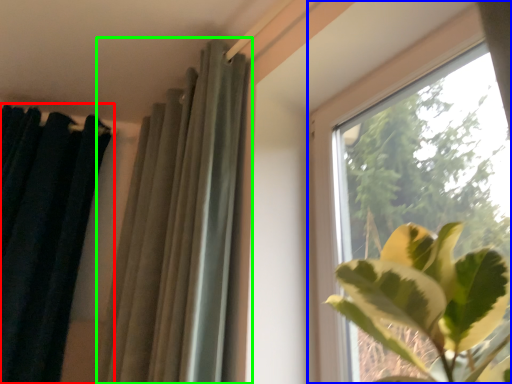
Question: Which object is positioned closest to curtain (highlighted by a red box)? Select from window (highlighted by a blue box) and curtain (highlighted by a green box).

Choices:
 (A) window
 (B) curtain

Answer: (B)